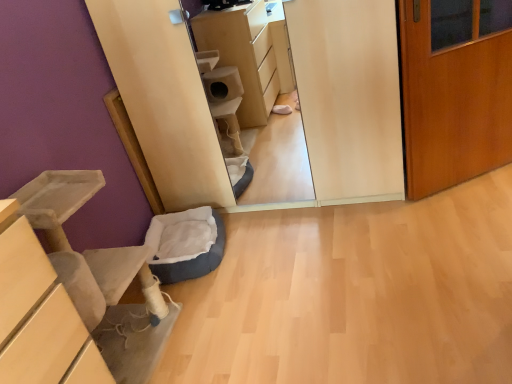
Question: Considering the relative sizes of dark blue plush cat bed at lower left and soft gray cat bed at lower left in the image provided, is dark blue plush cat bed at lower left taller than soft gray cat bed at lower left?

Choices:
 (A) yes
 (B) no

Answer: (B)

Question: Is dark blue plush cat bed at lower left facing towards soft gray cat bed at lower left?

Choices:
 (A) no
 (B) yes

Answer: (A)

Question: From a real-world perspective, is dark blue plush cat bed at lower left positioned under soft gray cat bed at lower left based on gravity?

Choices:
 (A) yes
 (B) no

Answer: (A)

Question: Is dark blue plush cat bed at lower left at the right side of soft gray cat bed at lower left?

Choices:
 (A) yes
 (B) no

Answer: (A)

Question: Is dark blue plush cat bed at lower left smaller than soft gray cat bed at lower left?

Choices:
 (A) no
 (B) yes

Answer: (B)

Question: Considering the positions of wooden door at right and dark blue plush cat bed at lower left in the image, is wooden door at right wider or thinner than dark blue plush cat bed at lower left?

Choices:
 (A) thin
 (B) wide

Answer: (A)

Question: Considering the positions of wooden door at right and dark blue plush cat bed at lower left in the image, is wooden door at right bigger or smaller than dark blue plush cat bed at lower left?

Choices:
 (A) big
 (B) small

Answer: (A)

Question: Relative to dark blue plush cat bed at lower left, is wooden door at right in front or behind?

Choices:
 (A) front
 (B) behind

Answer: (A)

Question: From a real-world perspective, is wooden door at right physically located above or below dark blue plush cat bed at lower left?

Choices:
 (A) above
 (B) below

Answer: (A)

Question: From the image's perspective, relative to dark blue plush cat bed at lower left, is soft gray cat bed at lower left above or below?

Choices:
 (A) above
 (B) below

Answer: (B)

Question: Considering the positions of point (142, 278) and point (206, 273), is point (142, 278) closer or farther from the camera than point (206, 273)?

Choices:
 (A) farther
 (B) closer

Answer: (B)

Question: Which is correct: soft gray cat bed at lower left is inside dark blue plush cat bed at lower left, or outside of it?

Choices:
 (A) outside
 (B) inside

Answer: (A)

Question: Looking at their shapes, would you say soft gray cat bed at lower left is wider or thinner than dark blue plush cat bed at lower left?

Choices:
 (A) thin
 (B) wide

Answer: (A)

Question: Considering their positions, is dark blue plush cat bed at lower left located in front of or behind soft gray cat bed at lower left?

Choices:
 (A) behind
 (B) front

Answer: (A)

Question: Would you say dark blue plush cat bed at lower left is to the left or to the right of soft gray cat bed at lower left in the picture?

Choices:
 (A) left
 (B) right

Answer: (B)